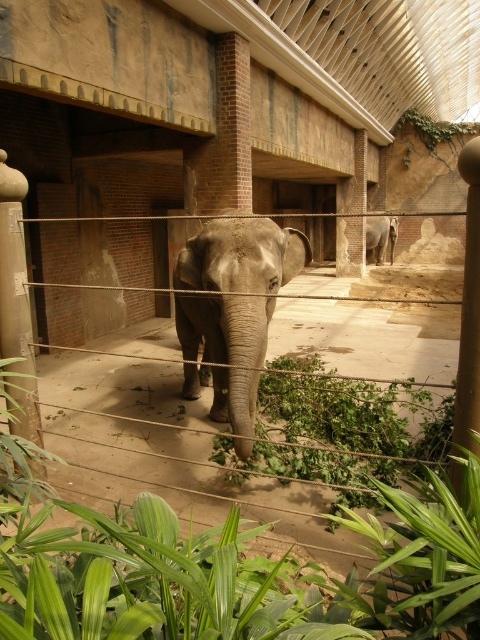
Question: In this image, where is green leafy plant at center located relative to gray matte elephant at center?

Choices:
 (A) above
 (B) below

Answer: (B)

Question: Is gray textured elephant at center thinner than gray matte elephant at center?

Choices:
 (A) no
 (B) yes

Answer: (B)

Question: Which object appears closest to the camera in this image?

Choices:
 (A) gray textured elephant at center
 (B) green leafy plant at lower center
 (C) gray matte elephant at center
 (D) green leafy plant at center

Answer: (B)

Question: Is green leafy plant at lower center below gray matte elephant at center?

Choices:
 (A) yes
 (B) no

Answer: (A)

Question: Among these points, which one is farthest from the camera?

Choices:
 (A) (394, 609)
 (B) (312, 467)
 (C) (195, 244)
 (D) (391, 259)

Answer: (D)

Question: Which point is farther to the camera?

Choices:
 (A) gray textured elephant at center
 (B) green leafy plant at center
 (C) gray matte elephant at center

Answer: (C)